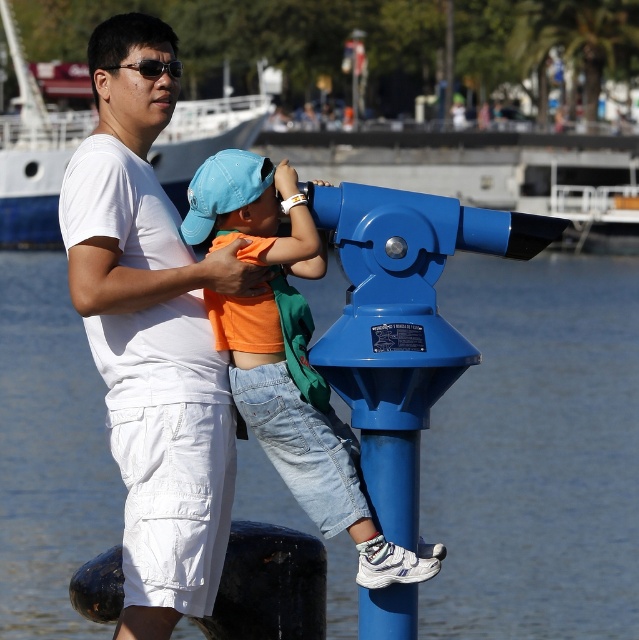
Question: Which object appears closest to the camera in this image?

Choices:
 (A) blue plastic telescope at center
 (B) blue plastic water at lower center

Answer: (A)

Question: Can you confirm if blue plastic water at lower center is thinner than blue plastic telescope at center?

Choices:
 (A) no
 (B) yes

Answer: (A)

Question: Which of these objects is positioned closest to the blue plastic telescope at center?

Choices:
 (A) matte black sunglasses at upper left
 (B) white cotton shirt at upper left
 (C) blue plastic water at lower center

Answer: (B)

Question: Which object appears farthest from the camera in this image?

Choices:
 (A) orange cotton shirt at upper center
 (B) white cotton shirt at upper left

Answer: (B)

Question: Does blue plastic telescope at center have a lesser width compared to matte black sunglasses at upper left?

Choices:
 (A) no
 (B) yes

Answer: (A)

Question: Does blue plastic water at lower center appear on the right side of blue plastic telescope at center?

Choices:
 (A) no
 (B) yes

Answer: (A)